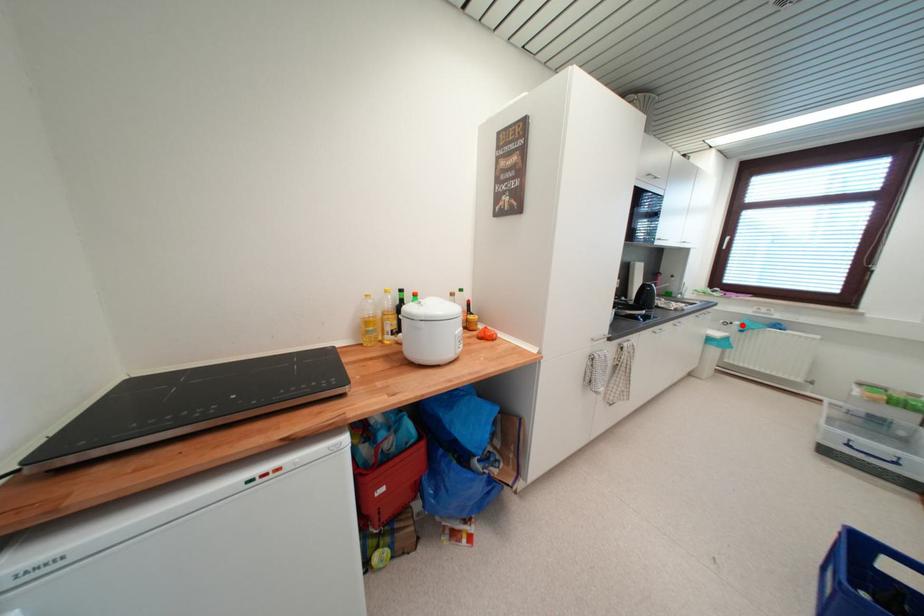
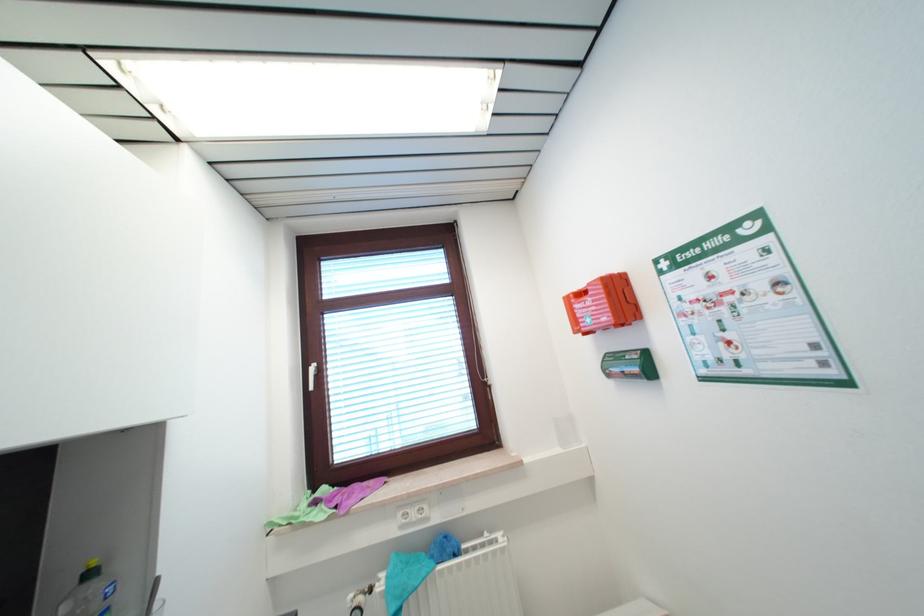
The point at the highlighted location is marked in the first image. Where is the corresponding point in the second image?

(385, 589)